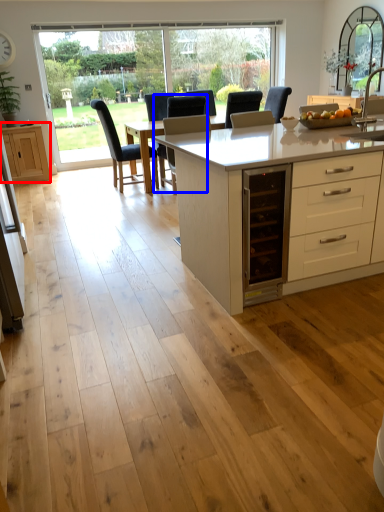
Question: Which object is closer to the camera taking this photo, cabinetry (highlighted by a red box) or chair (highlighted by a blue box)?

Choices:
 (A) cabinetry
 (B) chair

Answer: (B)